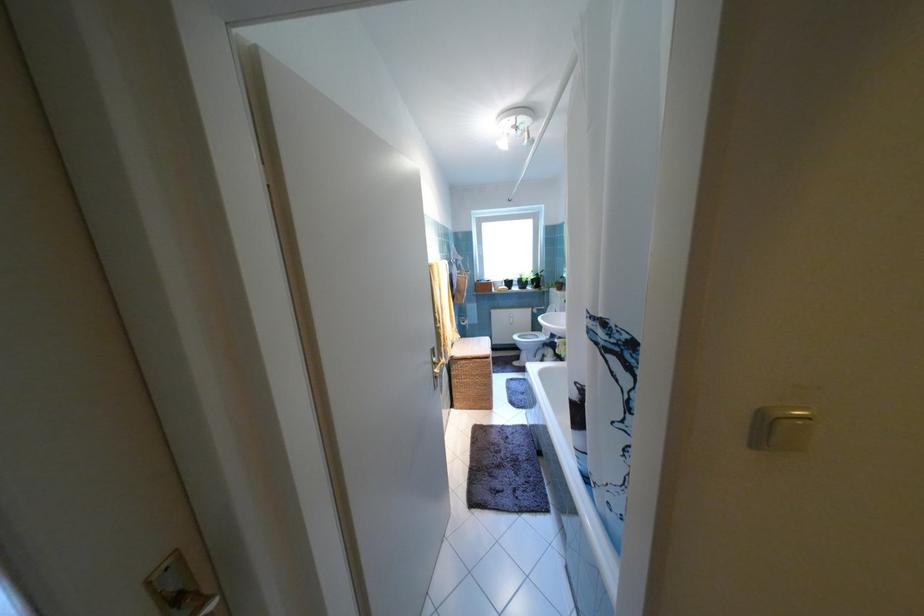
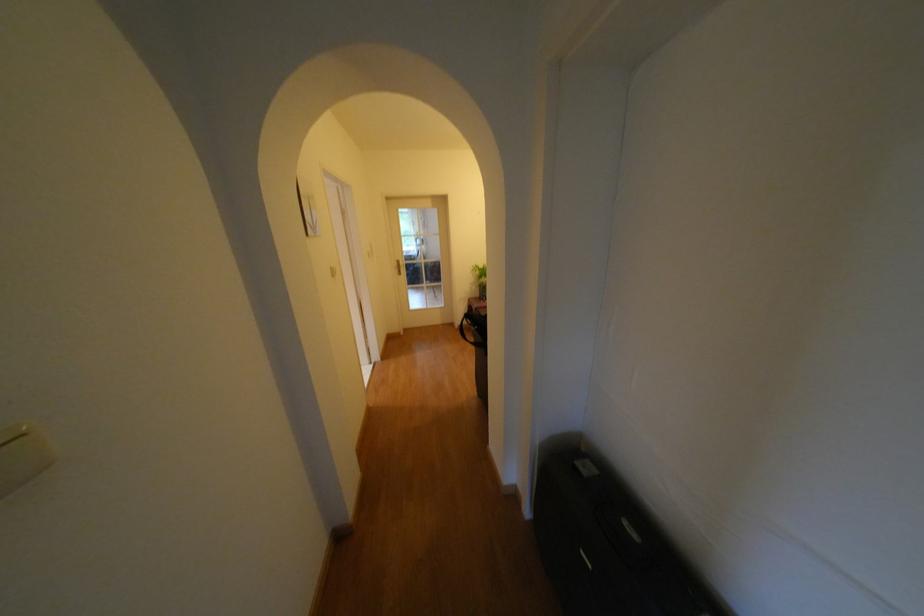
Based on the continuous images, in which direction is the camera rotating?

The rotation direction of the camera is right-down.